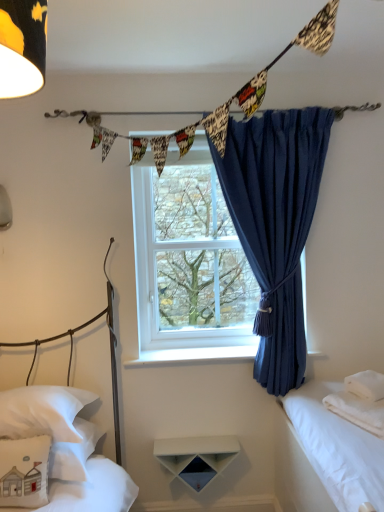
At what (x,y) coordinates should I click in order to perform the action: click on white matte shelf at center. Please return your answer as a coordinate pair (x, y). The image size is (384, 512). Looking at the image, I should click on (196, 457).

What do you see at coordinates (337, 447) in the screenshot? Image resolution: width=384 pixels, height=512 pixels. I see `white cotton bed at right, acting as the 3th bed starting from the left` at bounding box center [337, 447].

I want to click on white smooth window sill at center, so click(194, 355).

This screenshot has height=512, width=384. What are the coordinates of `white soft pillow at lower left, which is the second pillow from right to left` in the screenshot? It's located at (74, 453).

What do you see at coordinates (24, 471) in the screenshot? I see `white fabric pillow at lower left, which ranks as the 3th pillow in right-to-left order` at bounding box center [24, 471].

Locate an element on the screen. The image size is (384, 512). printed fabric bunting at upper center, the 2th clothesline from the back is located at coordinates (240, 95).

Identify the location of white cotton bed at left, arranged as the second bed when viewed from the left. [66, 448].

Based on the photo, is white soft towel at right not near clear glass window at center?

white soft towel at right is actually quite close to clear glass window at center.

Which is less distant, (375, 408) or (149, 278)?

Point (375, 408) appears to be closer to the viewer than point (149, 278).

Is white soft towel at right not inside clear glass window at center?

white soft towel at right lies outside clear glass window at center's area.

Looking at their sizes, would you say printed fabric bunting at upper center, the 2th clothesline from the back, is wider or thinner than printed fabric bunting at upper center, which is the second clothesline in front-to-back order?

Clearly, printed fabric bunting at upper center, the 2th clothesline from the back, has more width compared to printed fabric bunting at upper center, which is the second clothesline in front-to-back order.

Find the location of `clothesline on the left side of printed fabric bunting at upper center, which is the second clothesline in front-to-back order`. clothesline on the left side of printed fabric bunting at upper center, which is the second clothesline in front-to-back order is located at coordinates (240, 95).

From the image's perspective, is printed fabric bunting at upper center, the 2th clothesline from the back, below printed fabric bunting at upper center, which is the second clothesline in front-to-back order?

Yes, from the image's perspective, printed fabric bunting at upper center, the 2th clothesline from the back, is beneath printed fabric bunting at upper center, which is the second clothesline in front-to-back order.

Are printed fabric bunting at upper center, positioned as the 1th clothesline in front-to-back order, and printed fabric bunting at upper center, which is the second clothesline in front-to-back order, beside each other?

There is a gap between printed fabric bunting at upper center, positioned as the 1th clothesline in front-to-back order, and printed fabric bunting at upper center, which is the second clothesline in front-to-back order.

From a real-world perspective, is white fabric pillow at lower left, the first pillow positioned from the left, positioned under white smooth window sill at center based on gravity?

Correct, in the physical world, white fabric pillow at lower left, the first pillow positioned from the left, is lower than white smooth window sill at center.

Measure the distance from white fabric pillow at lower left, which ranks as the 3th pillow in right-to-left order, to white smooth window sill at center.

white fabric pillow at lower left, which ranks as the 3th pillow in right-to-left order, and white smooth window sill at center are 29.04 inches apart.

Which is closer, (16, 498) or (203, 347)?

Positioned in front is point (16, 498).

Can you confirm if white fabric pillow at lower left, the first pillow positioned from the left, is taller than white smooth window sill at center?

Yes.

How many degrees apart are the facing directions of white matte shelf at center and white fabric pillow at lower left, the first pillow positioned from the left?

The facing directions of white matte shelf at center and white fabric pillow at lower left, the first pillow positioned from the left, are 2.79 degrees apart.

Which is closer, (224, 464) or (6, 470)?

The point (6, 470) is more forward.

Could you tell me if white matte shelf at center is turned towards white fabric pillow at lower left, which ranks as the 3th pillow in right-to-left order?

No, white matte shelf at center is not turned towards white fabric pillow at lower left, which ranks as the 3th pillow in right-to-left order.

Is white matte shelf at center wider than white fabric pillow at lower left, which ranks as the 3th pillow in right-to-left order?

In fact, white matte shelf at center might be narrower than white fabric pillow at lower left, which ranks as the 3th pillow in right-to-left order.

Is printed fabric bunting at upper center, positioned as the 1th clothesline in front-to-back order, a part of blue fabric curtain at center?

No, printed fabric bunting at upper center, positioned as the 1th clothesline in front-to-back order, is located outside of blue fabric curtain at center.

Can you tell me how much blue fabric curtain at center and printed fabric bunting at upper center, positioned as the 1th clothesline in front-to-back order, differ in facing direction?

They differ by 61.5 degrees in their facing directions.

From a real-world perspective, between blue fabric curtain at center and printed fabric bunting at upper center, positioned as the 1th clothesline in front-to-back order, who is vertically higher?

printed fabric bunting at upper center, positioned as the 1th clothesline in front-to-back order, is physically above.

Who is bigger, white soft pillow at lower left, the 3th bed viewed from the right, or clear glass window at center?

With larger size is white soft pillow at lower left, the 3th bed viewed from the right.

Does white soft pillow at lower left, acting as the first bed starting from the left, have a greater width compared to clear glass window at center?

Yes, white soft pillow at lower left, acting as the first bed starting from the left, is wider than clear glass window at center.

Is white soft pillow at lower left, the 3th bed viewed from the right, shorter than clear glass window at center?

Correct, white soft pillow at lower left, the 3th bed viewed from the right, is not as tall as clear glass window at center.

Is white soft pillow at lower left, the 3th bed viewed from the right, situated inside clear glass window at center or outside?

A: white soft pillow at lower left, the 3th bed viewed from the right, cannot be found inside clear glass window at center.

At what (x,y) coordinates should I click in order to perform the action: click on table that appears below the white soft pillow at lower left, which ranks as the 2th pillow in left-to-right order (from a real-world perspective). Please return your answer as a coordinate pair (x, y). The image size is (384, 512). Looking at the image, I should click on (196, 457).

Which is correct: white matte shelf at center is inside white soft pillow at lower left, which is the second pillow from right to left, or outside of it?

white matte shelf at center lies outside white soft pillow at lower left, which is the second pillow from right to left.

Is white matte shelf at center oriented away from white soft pillow at lower left, which ranks as the 2th pillow in left-to-right order?

No.

The height and width of the screenshot is (512, 384). What are the coordinates of `sheet below the clear glass window at center (from the image's perspective)` in the screenshot? It's located at (358, 411).

You are a GUI agent. You are given a task and a screenshot of the screen. Output one action in this format:
    pyautogui.click(x=<x>, y=<y>)
    Task: Click on the clothesline above the printed fabric bunting at upper center, positioned as the 1th clothesline in front-to-back order (from a real-world perspective)
    The width and height of the screenshot is (384, 512).
    Given the screenshot: What is the action you would take?
    pyautogui.click(x=105, y=115)

Considering their positions, is white fabric pillow at lower left, which ranks as the 3th pillow in right-to-left order, positioned closer to printed fabric bunting at upper center, positioned as the 1th clothesline in front-to-back order, than white cotton bed at right, acting as the 3th bed starting from the left?

The object closer to printed fabric bunting at upper center, positioned as the 1th clothesline in front-to-back order, is white cotton bed at right, acting as the 3th bed starting from the left.

Based on their spatial positions, is printed fabric bunting at upper center, the 2th clothesline from the back, or white fabric pillow at lower left, the first pillow positioned from the left, closer to white cotton bed at left, arranged as the second bed when viewed from the left?

The object closer to white cotton bed at left, arranged as the second bed when viewed from the left, is white fabric pillow at lower left, the first pillow positioned from the left.

Based on their spatial positions, is white cotton bed at left, the second bed in the right-to-left sequence, or printed fabric bunting at upper center, the 2th clothesline from the back, further from white fabric pillow at lower left, which ranks as the 3th pillow in right-to-left order?

Based on the image, printed fabric bunting at upper center, the 2th clothesline from the back, appears to be further to white fabric pillow at lower left, which ranks as the 3th pillow in right-to-left order.

Which object lies further to the anchor point white soft towel at right, printed fabric bunting at upper center, positioned as the 1th clothesline in front-to-back order, or white soft pillow at lower left, acting as the first bed starting from the left?

printed fabric bunting at upper center, positioned as the 1th clothesline in front-to-back order, is positioned further to the anchor white soft towel at right.

Looking at the image, which one is located further to printed fabric bunting at upper center, which is the second clothesline in front-to-back order, blue fabric curtain at center or white soft pillow at lower left, which is the second pillow from right to left?

white soft pillow at lower left, which is the second pillow from right to left.

When comparing their distances from clear glass window at center, does white matte shelf at center or white soft pillow at lower left, acting as the first bed starting from the left, seem further?

white matte shelf at center is further to clear glass window at center.

Estimate the real-world distances between objects in this image. Which object is further from white matte shelf at center, white soft pillow at lower left, the 3th bed viewed from the right, or white cotton bed at right, acting as the 3th bed starting from the left?

white cotton bed at right, acting as the 3th bed starting from the left, is positioned further to the anchor white matte shelf at center.

Which object lies nearer to the anchor point blue fabric curtain at center, white soft pillow at lower left, the 3th bed viewed from the right, or white soft towel at right?

white soft towel at right is positioned closer to the anchor blue fabric curtain at center.

Find the location of a particular element. window between white soft pillow at lower left, which ranks as the 2th pillow in left-to-right order, and white cotton bed at right, acting as the 3th bed starting from the left is located at coordinates click(x=188, y=258).

The height and width of the screenshot is (512, 384). I want to click on pillow between white fabric pillow at lower left, which ranks as the 3th pillow in right-to-left order, and white matte shelf at center, in the horizontal direction, so (x=74, y=453).

I want to click on table between white soft pillow at lower left, the 3th bed viewed from the right, and white soft towel at right, so click(x=196, y=457).

This screenshot has height=512, width=384. I want to click on clothesline between white cotton bed at left, the second bed in the right-to-left sequence, and white soft pillow at right, which is the first pillow in right-to-left order, from front to back, so (x=240, y=95).